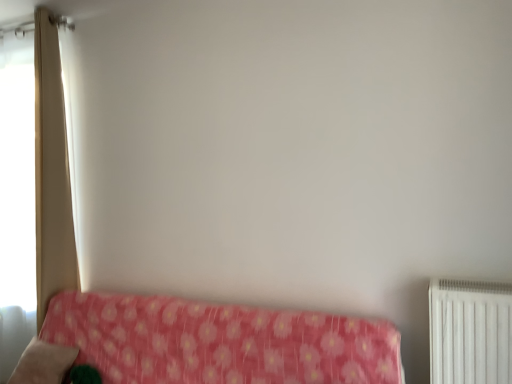
Measure the distance between point (60, 379) and camera.

The distance of point (60, 379) from camera is 7.46 feet.

Looking at this image, measure the distance between pink floral fabric at lower left and camera.

The distance of pink floral fabric at lower left from camera is 5.75 feet.

At what (x,y) coordinates should I click in order to perform the action: click on beige fabric curtain at left. Please return your answer as a coordinate pair (x, y). Image resolution: width=512 pixels, height=384 pixels. Looking at the image, I should click on (51, 171).

From a real-world perspective, between soft pink fabric pillow at lower left and beige fabric curtain at left, who is vertically lower?

From a 3D spatial view, soft pink fabric pillow at lower left is below.

Considering the positions of objects soft pink fabric pillow at lower left and beige fabric curtain at left in the image provided, who is more to the right, soft pink fabric pillow at lower left or beige fabric curtain at left?

soft pink fabric pillow at lower left.

Considering the relative sizes of soft pink fabric pillow at lower left and beige fabric curtain at left in the image provided, is soft pink fabric pillow at lower left bigger than beige fabric curtain at left?

Actually, soft pink fabric pillow at lower left might be smaller than beige fabric curtain at left.

Locate an element on the screen. This screenshot has width=512, height=384. pillow on the right of beige fabric curtain at left is located at coordinates (42, 363).

From the image's perspective, relative to beige fabric curtain at left, is pink floral fabric at lower left above or below?

Clearly, from the image's perspective, pink floral fabric at lower left is below beige fabric curtain at left.

Consider the image. In the image, is pink floral fabric at lower left on the left side or the right side of beige fabric curtain at left?

Clearly, pink floral fabric at lower left is on the right of beige fabric curtain at left in the image.

Do you think pink floral fabric at lower left is within beige fabric curtain at left, or outside of it?

pink floral fabric at lower left exists outside the volume of beige fabric curtain at left.

Can you tell me how much pink floral fabric at lower left and beige fabric curtain at left differ in facing direction?

3.22e-05 degrees separate the facing orientations of pink floral fabric at lower left and beige fabric curtain at left.

In terms of width, does beige fabric curtain at left look wider or thinner when compared to soft pink fabric pillow at lower left?

Considering their sizes, beige fabric curtain at left looks slimmer than soft pink fabric pillow at lower left.

Where is `curtain behind the soft pink fabric pillow at lower left`? This screenshot has height=384, width=512. curtain behind the soft pink fabric pillow at lower left is located at coordinates (51, 171).

Looking at this image, is beige fabric curtain at left in front of or behind soft pink fabric pillow at lower left in the image?

In the image, beige fabric curtain at left appears behind soft pink fabric pillow at lower left.

Can soft pink fabric pillow at lower left be found inside beige fabric curtain at left?

No, beige fabric curtain at left does not contain soft pink fabric pillow at lower left.

From the picture: From the image's perspective, is soft pink fabric pillow at lower left under pink floral fabric at lower left?

Yes, from the image's perspective, soft pink fabric pillow at lower left is beneath pink floral fabric at lower left.

Does soft pink fabric pillow at lower left come behind pink floral fabric at lower left?

Yes, it is behind pink floral fabric at lower left.

Is soft pink fabric pillow at lower left situated inside pink floral fabric at lower left or outside?

soft pink fabric pillow at lower left is inside pink floral fabric at lower left.

Considering the positions of objects soft pink fabric pillow at lower left and pink floral fabric at lower left in the image provided, who is more to the left, soft pink fabric pillow at lower left or pink floral fabric at lower left?

From the viewer's perspective, soft pink fabric pillow at lower left appears more on the left side.

Which object is further away from the camera, beige fabric curtain at left or pink floral fabric at lower left?

beige fabric curtain at left is further away from the camera.

Looking at their sizes, would you say beige fabric curtain at left is wider or thinner than pink floral fabric at lower left?

beige fabric curtain at left is thinner than pink floral fabric at lower left.

From a real-world perspective, is beige fabric curtain at left physically above pink floral fabric at lower left?

Correct, in the physical world, beige fabric curtain at left is higher than pink floral fabric at lower left.

Can you confirm if pink floral fabric at lower left is shorter than soft pink fabric pillow at lower left?

Incorrect, the height of pink floral fabric at lower left does not fall short of that of soft pink fabric pillow at lower left.

From the image's perspective, which is below, pink floral fabric at lower left or soft pink fabric pillow at lower left?

From the image's view, soft pink fabric pillow at lower left is below.

Considering the positions of objects pink floral fabric at lower left and soft pink fabric pillow at lower left in the image provided, who is more to the right, pink floral fabric at lower left or soft pink fabric pillow at lower left?

Positioned to the right is pink floral fabric at lower left.

Is pink floral fabric at lower left placed right next to soft pink fabric pillow at lower left?

pink floral fabric at lower left is not next to soft pink fabric pillow at lower left, and they're not touching.

Locate an element on the screen. The width and height of the screenshot is (512, 384). curtain behind the soft pink fabric pillow at lower left is located at coordinates (51, 171).

Find the location of a particular element. This screenshot has height=384, width=512. furniture below the beige fabric curtain at left (from a real-world perspective) is located at coordinates coord(219,342).

Considering their positions, is soft pink fabric pillow at lower left positioned closer to pink floral fabric at lower left than beige fabric curtain at left?

soft pink fabric pillow at lower left lies closer to pink floral fabric at lower left than the other object.

Based on their spatial positions, is beige fabric curtain at left or soft pink fabric pillow at lower left closer to pink floral fabric at lower left?

soft pink fabric pillow at lower left.

Considering their positions, is beige fabric curtain at left positioned further to soft pink fabric pillow at lower left than pink floral fabric at lower left?

beige fabric curtain at left.

Which object lies nearer to the anchor point beige fabric curtain at left, soft pink fabric pillow at lower left or pink floral fabric at lower left?

Among the two, soft pink fabric pillow at lower left is located nearer to beige fabric curtain at left.

From the image, which object appears to be nearer to soft pink fabric pillow at lower left, pink floral fabric at lower left or beige fabric curtain at left?

pink floral fabric at lower left.

Looking at the image, which one is located closer to beige fabric curtain at left, pink floral fabric at lower left or soft pink fabric pillow at lower left?

soft pink fabric pillow at lower left is closer to beige fabric curtain at left.

Image resolution: width=512 pixels, height=384 pixels. I want to click on pillow positioned between pink floral fabric at lower left and beige fabric curtain at left from near to far, so click(42, 363).